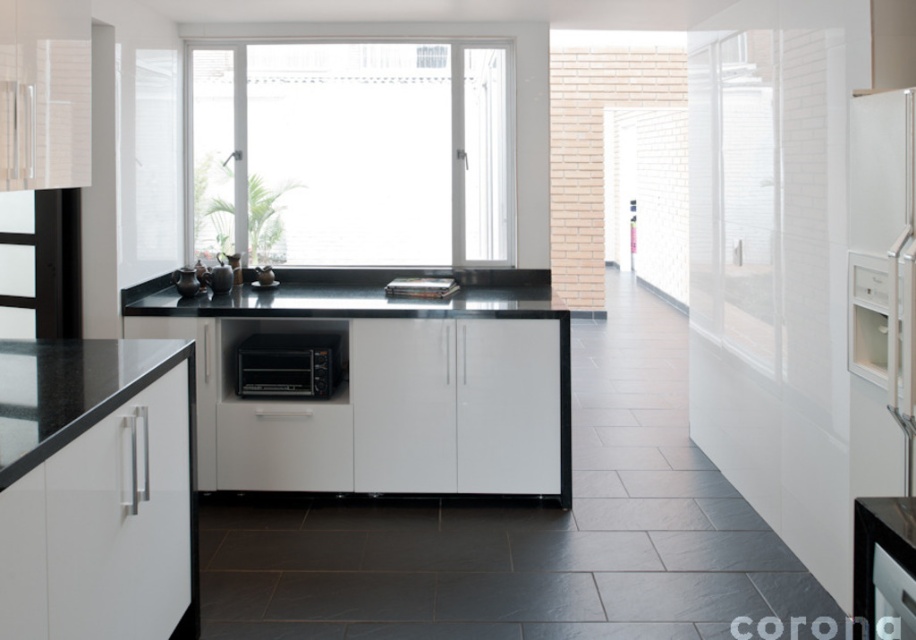
You are a chef preparing to move a black plastic toaster oven at center to the black granite countertop at lower left. The oven is 1.6 meters long. Can you slide it horizontally without rotating it?

The distance between the black granite countertop at lower left and the black plastic toaster oven at center is 1.55 meters. Since the oven is 1.6 meters long, it cannot be slid horizontally without rotating it as there isn not enough space.

You are trying to determine if the transparent glass door at right can accommodate the black plastic toaster oven at center vertically. Based on their heights, will the toaster oven fit inside the door when placed upright?

The transparent glass door at right has a greater height compared to the black plastic toaster oven at center, so the toaster oven will fit vertically inside the door when placed upright.